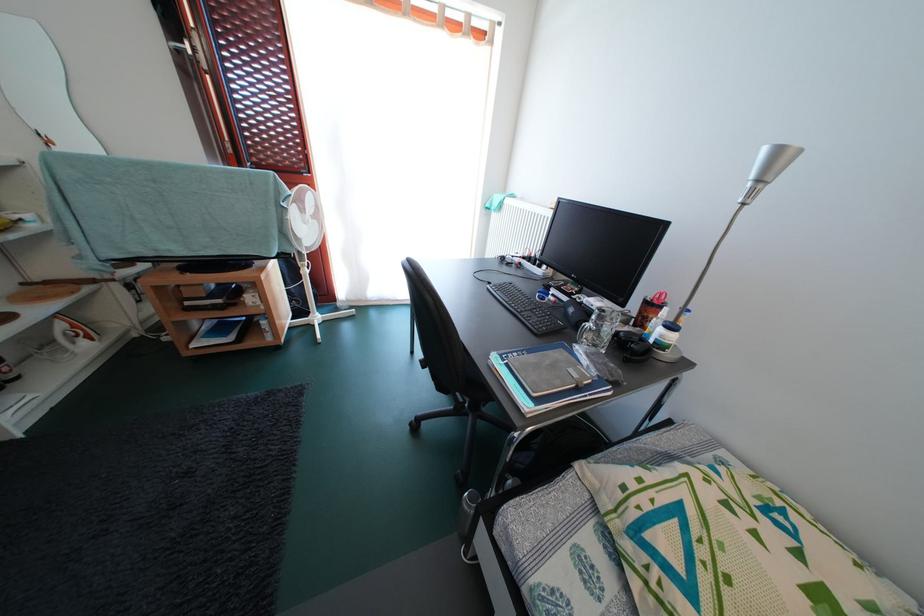
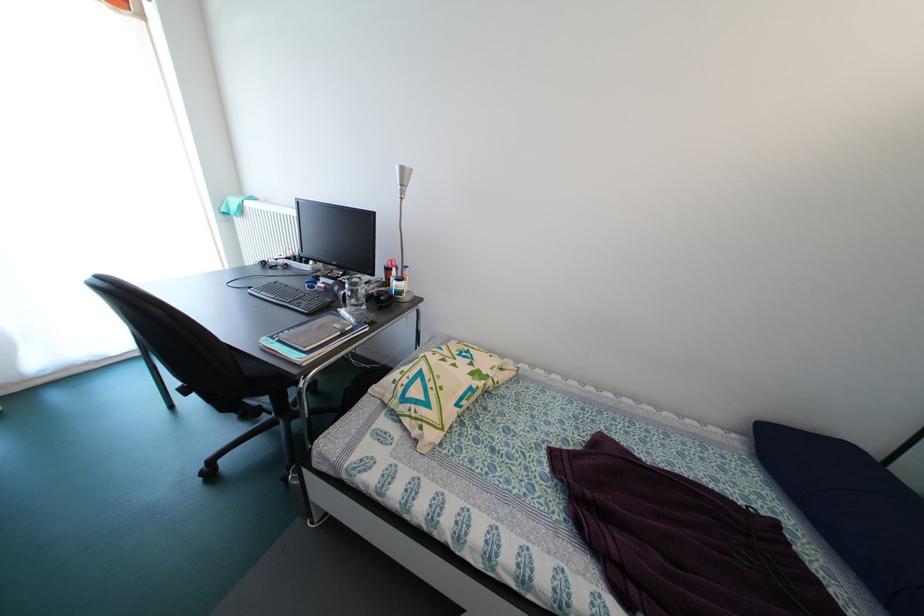
Where in the second image is the point corresponding to point (785, 156) from the first image?

(409, 175)